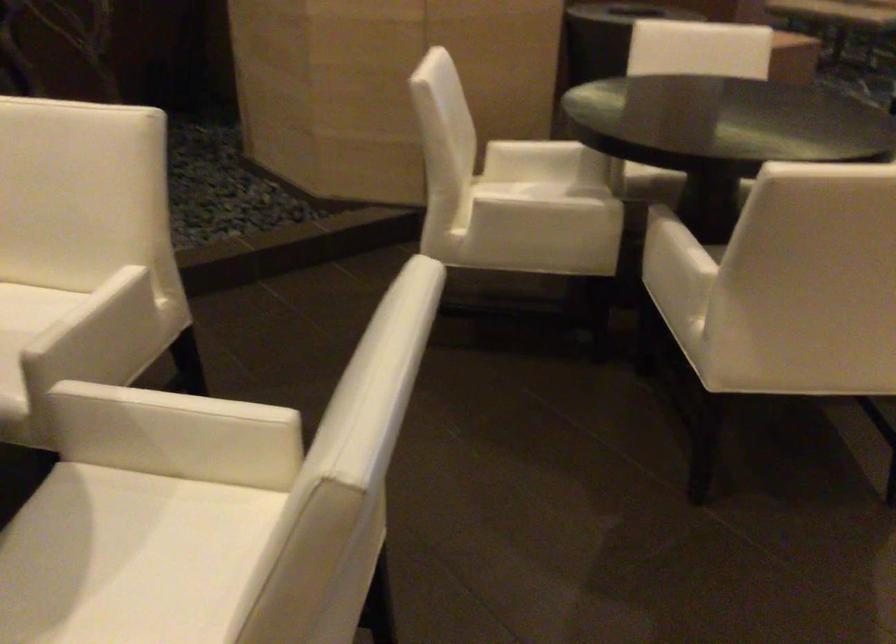
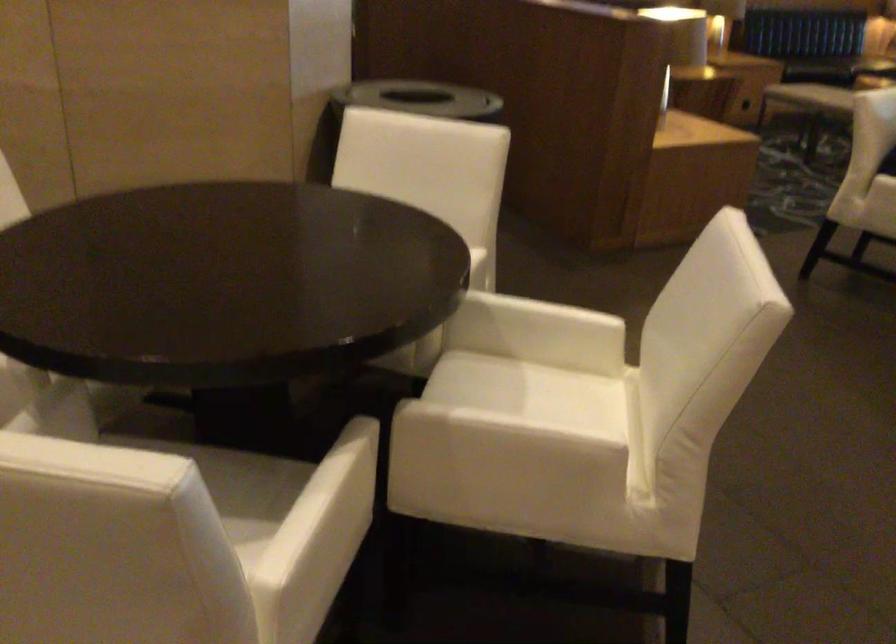
In a continuous first-person perspective shot, in which direction is the camera moving?

The movement direction of the cameraman is right, forward.